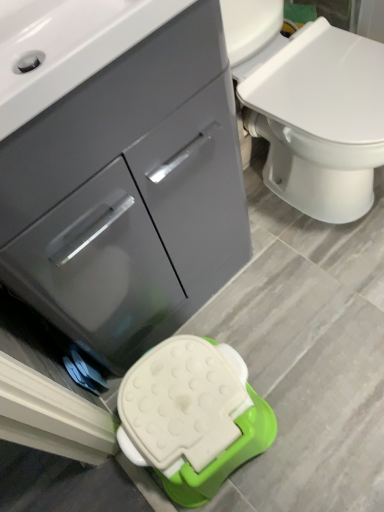
Question: Is white glossy sink at upper left thinner than white plastic stool at lower center?

Choices:
 (A) yes
 (B) no

Answer: (B)

Question: Is the position of white glossy sink at upper left more distant than that of white plastic stool at lower center?

Choices:
 (A) no
 (B) yes

Answer: (A)

Question: Is white glossy sink at upper left positioned in front of white plastic stool at lower center?

Choices:
 (A) no
 (B) yes

Answer: (B)

Question: Considering the relative sizes of white glossy sink at upper left and white plastic stool at lower center in the image provided, is white glossy sink at upper left smaller than white plastic stool at lower center?

Choices:
 (A) no
 (B) yes

Answer: (A)

Question: Could you tell me if white glossy sink at upper left is facing white plastic stool at lower center?

Choices:
 (A) no
 (B) yes

Answer: (A)

Question: From a real-world perspective, is white glossy sink at upper left physically located above or below white plastic stool at lower center?

Choices:
 (A) above
 (B) below

Answer: (A)

Question: Considering the positions of white glossy sink at upper left and white plastic stool at lower center in the image, is white glossy sink at upper left taller or shorter than white plastic stool at lower center?

Choices:
 (A) short
 (B) tall

Answer: (A)

Question: Considering the positions of white glossy sink at upper left and white plastic stool at lower center in the image, is white glossy sink at upper left bigger or smaller than white plastic stool at lower center?

Choices:
 (A) big
 (B) small

Answer: (A)

Question: From the image's perspective, is white glossy sink at upper left located above or below white plastic stool at lower center?

Choices:
 (A) below
 (B) above

Answer: (B)

Question: From a real-world perspective, is matte gray cabinet at center physically located above or below white plastic stool at lower center?

Choices:
 (A) below
 (B) above

Answer: (B)

Question: Is matte gray cabinet at center to the left or to the right of white plastic stool at lower center in the image?

Choices:
 (A) right
 (B) left

Answer: (B)

Question: In terms of height, does matte gray cabinet at center look taller or shorter compared to white plastic stool at lower center?

Choices:
 (A) tall
 (B) short

Answer: (A)

Question: Is point (182, 164) positioned closer to the camera than point (157, 456)?

Choices:
 (A) farther
 (B) closer

Answer: (B)

Question: Is white plastic stool at lower center to the left or to the right of white glossy sink at upper left in the image?

Choices:
 (A) left
 (B) right

Answer: (B)

Question: Considering their positions, is white plastic stool at lower center located in front of or behind white glossy sink at upper left?

Choices:
 (A) behind
 (B) front

Answer: (A)